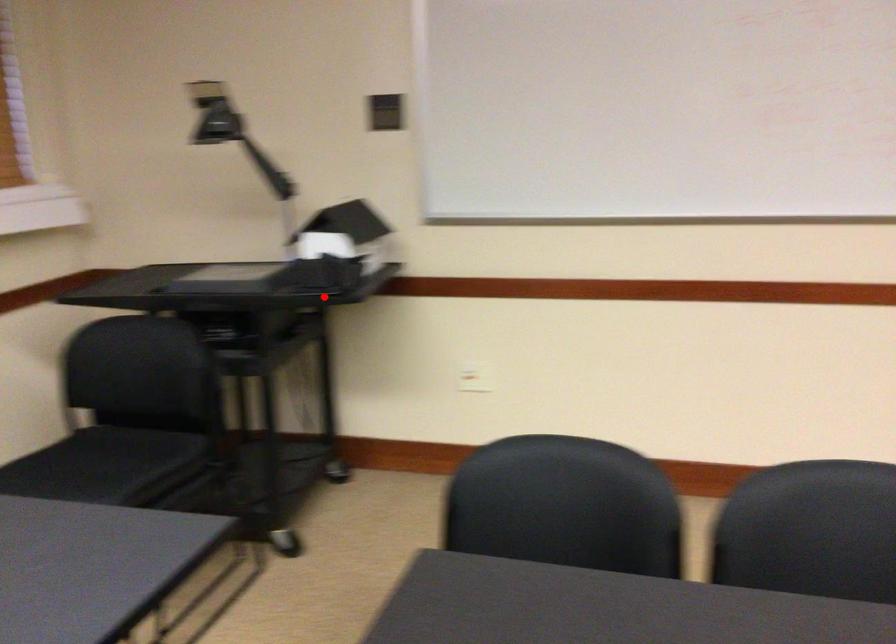
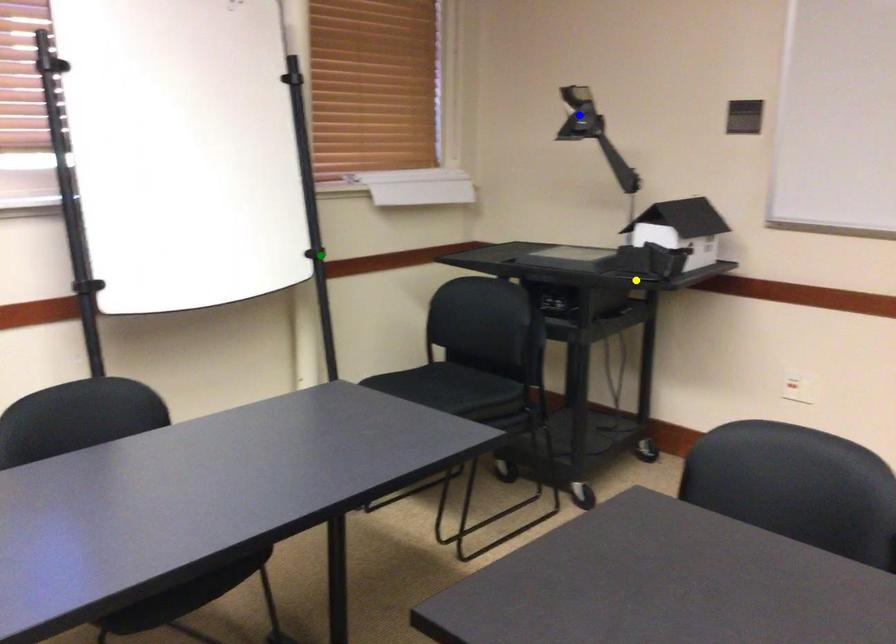
Question: I am providing you with two images of the same scene from different viewpoints. A red point is marked on the first image. You are given multiple points on the second image. Which point in image 2 is actually the same real-world point as the red point in image 1?

Choices:
 (A) blue point
 (B) yellow point
 (C) green point

Answer: (B)